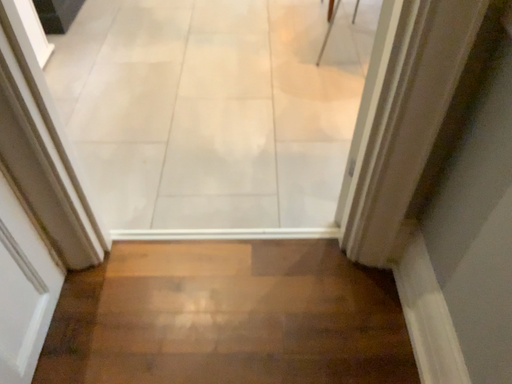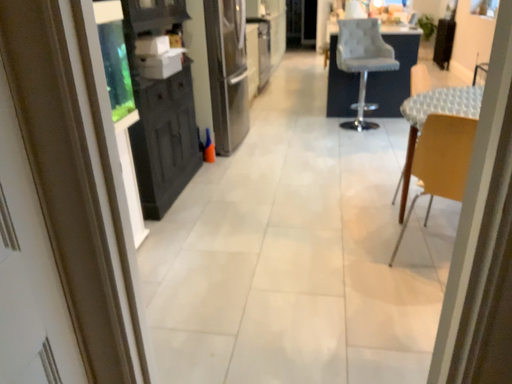
Question: How did the camera likely rotate when shooting the video?

Choices:
 (A) rotated downward
 (B) rotated upward

Answer: (B)